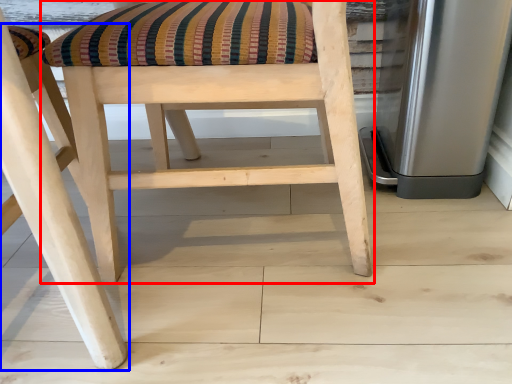
Question: Which point is further to the camera, chair (highlighted by a red box) or chair (highlighted by a blue box)?

Choices:
 (A) chair
 (B) chair

Answer: (A)